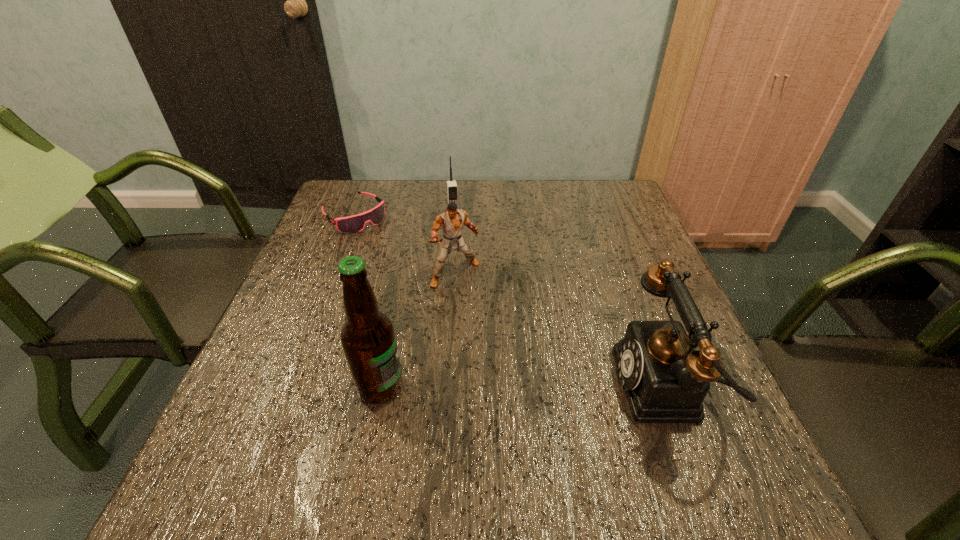
Find the location of a particular element. vacant region between the third farthest object and the rightmost object is located at coordinates (560, 330).

At what (x,y) coordinates should I click in order to perform the action: click on vacant space that is in between the shortest object and the cellular telephone. Please return your answer as a coordinate pair (x, y). This screenshot has height=540, width=960. Looking at the image, I should click on (404, 216).

Where is `vacant space that's between the leftmost object and the rightmost object`? This screenshot has height=540, width=960. vacant space that's between the leftmost object and the rightmost object is located at coordinates (510, 301).

Locate an element on the screen. free space between the cellular telephone and the beer bottle is located at coordinates (417, 302).

The image size is (960, 540). I want to click on vacant space in between the third nearest object and the telephone, so click(x=560, y=330).

Find the location of a particular element. The image size is (960, 540). object that is the fourth nearest to the goggles is located at coordinates (665, 380).

At what (x,y) coordinates should I click in order to perform the action: click on the fourth closest object to the tallest object. Please return your answer as a coordinate pair (x, y). This screenshot has width=960, height=540. Looking at the image, I should click on (452, 190).

Locate an element on the screen. Image resolution: width=960 pixels, height=540 pixels. vacant space that satisfies the following two spatial constraints: 1. on the front side of the cellular telephone; 2. on the left side of the leftmost object is located at coordinates (354, 217).

You are a GUI agent. You are given a task and a screenshot of the screen. Output one action in this format:
    pyautogui.click(x=<x>, y=<y>)
    Task: Click on the free space that satisfies the following two spatial constraints: 1. on the front side of the telephone; 2. on the front of the third nearest object at the rotary dial
    The height and width of the screenshot is (540, 960).
    Given the screenshot: What is the action you would take?
    [x=448, y=387]

I want to click on free location that satisfies the following two spatial constraints: 1. on the front side of the cellular telephone; 2. on the front of the telephone at the rotary dial, so [440, 387].